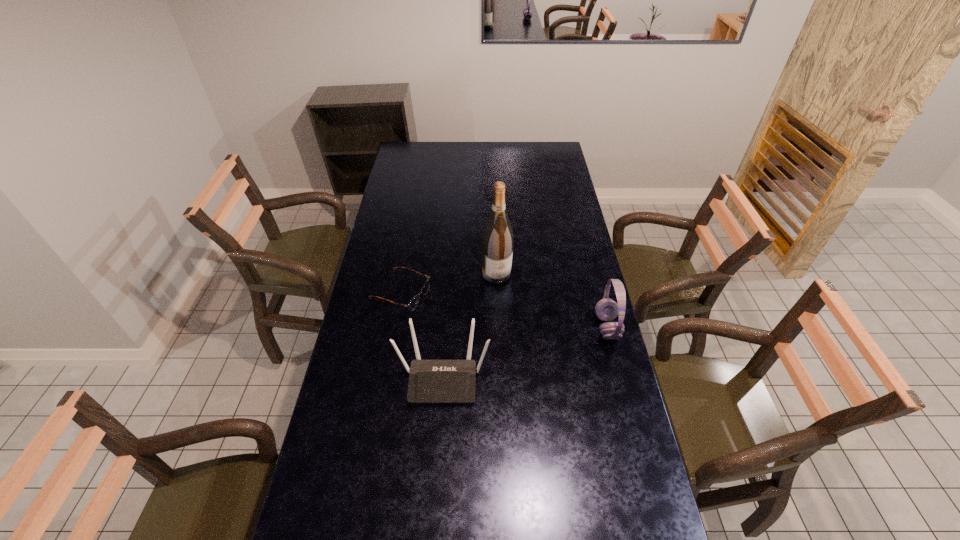
Find the location of a particular element. router is located at coordinates (430, 381).

Locate an element on the screen. The width and height of the screenshot is (960, 540). the rightmost object is located at coordinates (606, 309).

You are a GUI agent. You are given a task and a screenshot of the screen. Output one action in this format:
    pyautogui.click(x=<x>, y=<y>)
    Task: Click on the wine bottle
    The image size is (960, 540).
    Given the screenshot: What is the action you would take?
    pos(497,240)

Where is `spectacles`? The height and width of the screenshot is (540, 960). spectacles is located at coordinates (413, 303).

Find the location of a particular element. This screenshot has height=540, width=960. free space located 0.190m on the front-facing side of the nearest object is located at coordinates (437, 468).

This screenshot has height=540, width=960. In order to click on blank space located on the headband and ear cups of the rightmost object in this screenshot , I will do `click(515, 327)`.

Find the location of a particular element. The height and width of the screenshot is (540, 960). vacant position located on the headband and ear cups of the rightmost object is located at coordinates (519, 327).

Identify the location of vacant space situated on the headband and ear cups of the rightmost object. The height and width of the screenshot is (540, 960). (492, 327).

At what (x,y) coordinates should I click in order to perform the action: click on vacant space located on the label of the wine bottle. Please return your answer as a coordinate pair (x, y). This screenshot has width=960, height=540. Looking at the image, I should click on (523, 332).

Where is `free region located on the label of the wine bottle`? The height and width of the screenshot is (540, 960). free region located on the label of the wine bottle is located at coordinates (526, 339).